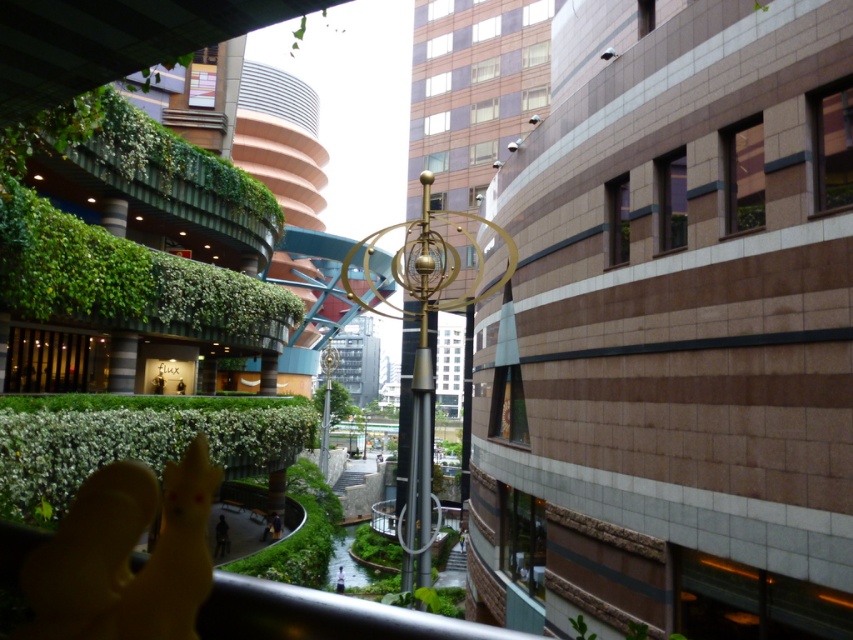
Question: Among these points, which one is farthest from the camera?

Choices:
 (A) (164, 432)
 (B) (126, 141)
 (C) (276, 518)
 (D) (13, 307)

Answer: (C)

Question: Which point is farther to the camera?

Choices:
 (A) (337, 582)
 (B) (35, 195)

Answer: (A)

Question: Is green leafy hedge at left to the left of dark blue fabric at lower center from the viewer's perspective?

Choices:
 (A) yes
 (B) no

Answer: (A)

Question: Can you confirm if green leafy hedge at lower left is positioned to the left of dark blue fabric at lower center?

Choices:
 (A) yes
 (B) no

Answer: (B)

Question: Which object is closer to the camera taking this photo?

Choices:
 (A) light blue fabric person at center
 (B) green leafy hedge at upper left
 (C) green leafy hedge at lower left

Answer: (C)

Question: Does dark blue fabric at lower center come behind light blue fabric person at center?

Choices:
 (A) yes
 (B) no

Answer: (B)